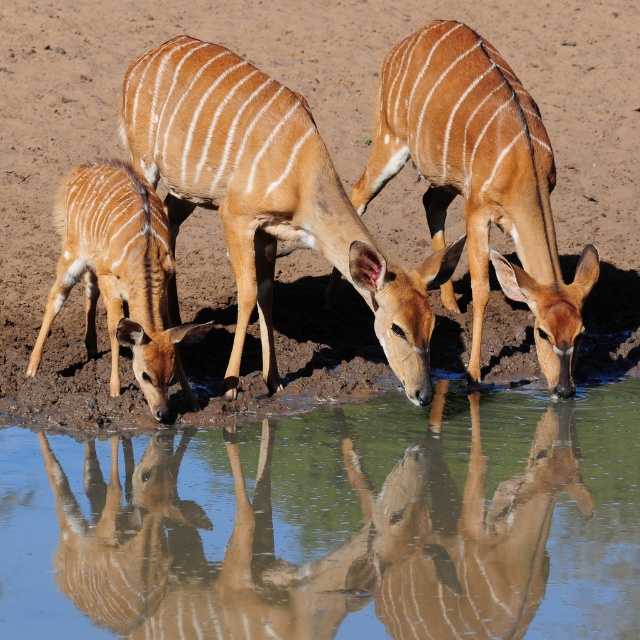
Question: Which point is closer to the camera?

Choices:
 (A) brown striped antelope at center
 (B) light brown fur at lower left

Answer: (A)

Question: Is brown striped antelope at center bigger than light brown fur at lower left?

Choices:
 (A) no
 (B) yes

Answer: (B)

Question: Is clear water at center thinner than light brown fur at lower left?

Choices:
 (A) no
 (B) yes

Answer: (A)

Question: Does brown striped antelope at center lie behind brown glossy antelope at center?

Choices:
 (A) no
 (B) yes

Answer: (A)

Question: Which of these objects is positioned closest to the brown glossy antelope at center?

Choices:
 (A) clear water at center
 (B) light brown fur at lower left
 (C) brown striped antelope at center

Answer: (C)

Question: Which point is farther to the camera?

Choices:
 (A) brown glossy antelope at center
 (B) brown striped antelope at center
 (C) light brown fur at lower left
 (D) clear water at center

Answer: (A)